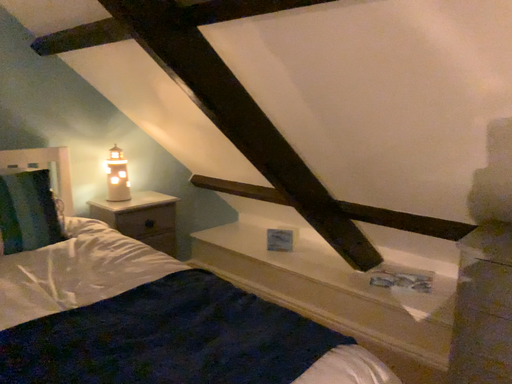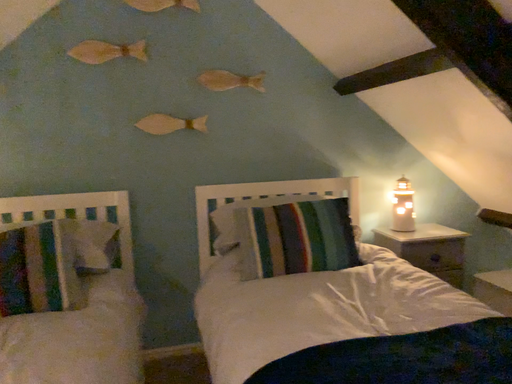
Question: How did the camera likely rotate when shooting the video?

Choices:
 (A) rotated left
 (B) rotated right

Answer: (A)